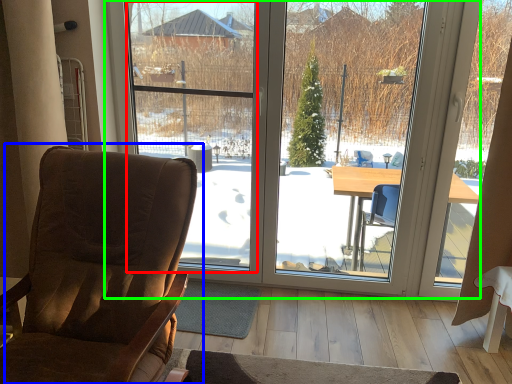
Question: Based on their relative distances, which object is nearer to window screen (highlighted by a red box)? Choose from chair (highlighted by a blue box) and window (highlighted by a green box).

Choices:
 (A) chair
 (B) window

Answer: (B)